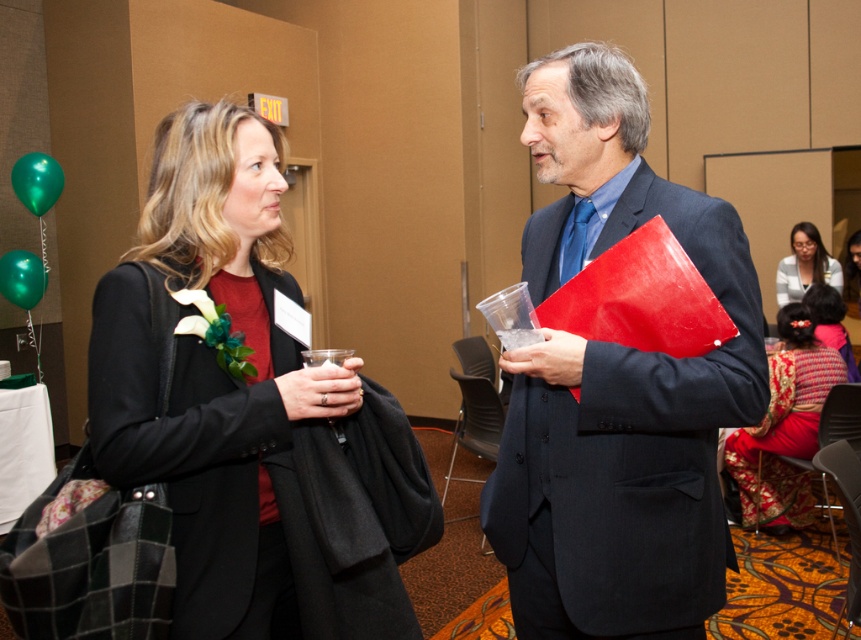
Which is behind, point (132, 339) or point (816, 310)?

Positioned behind is point (816, 310).

What do you see at coordinates (214, 372) in the screenshot? I see `matte black jacket at center` at bounding box center [214, 372].

Where is `matte black jacket at center`? matte black jacket at center is located at coordinates (214, 372).

Between matte white blouse at upper right and silky red dress at lower right, which one has less height?

Standing shorter between the two is matte white blouse at upper right.

Can you confirm if matte white blouse at upper right is thinner than silky red dress at lower right?

Yes.

Identify the location of matte white blouse at upper right. (804, 266).

Does matte black suit at center have a larger size compared to matte white blouse at upper right?

Indeed, matte black suit at center has a larger size compared to matte white blouse at upper right.

From the picture: Which of these two, matte black suit at center or matte white blouse at upper right, stands taller?

Standing taller between the two is matte black suit at center.

Who is more distant from viewer, (562, 336) or (821, 246)?

The point (821, 246) is more distant.

Where is `matte black suit at center`? The image size is (861, 640). matte black suit at center is located at coordinates (616, 385).